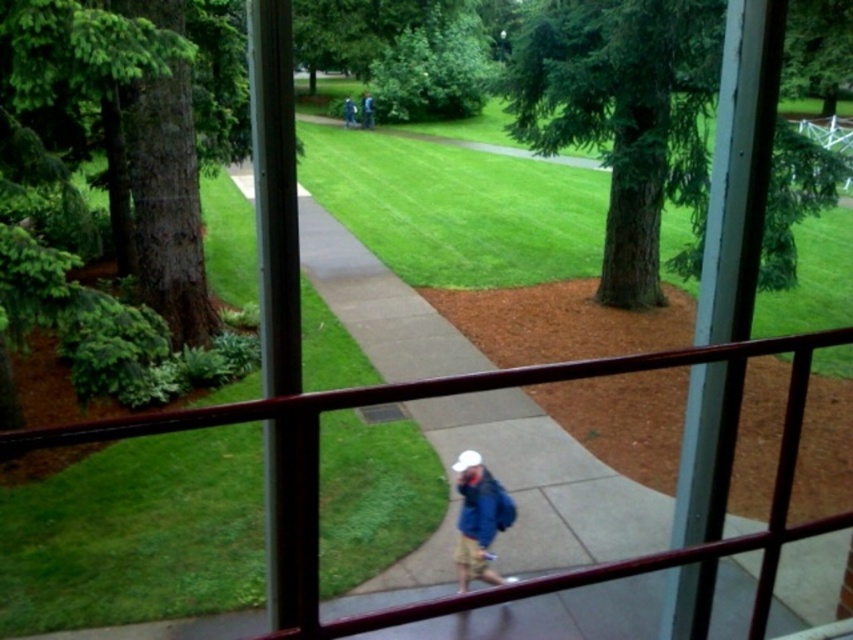
Question: Can you confirm if green leafy tree at upper center is positioned below blue denim jacket at center?

Choices:
 (A) no
 (B) yes

Answer: (A)

Question: Which is nearer to the green leafy tree at upper center?

Choices:
 (A) green textured tree at center
 (B) blue denim jacket at center

Answer: (A)

Question: Which object appears closest to the camera in this image?

Choices:
 (A) blue denim jacket at center
 (B) green textured tree at center

Answer: (A)

Question: Can you confirm if green textured tree at center is positioned to the left of blue denim jacket at center?

Choices:
 (A) yes
 (B) no

Answer: (B)

Question: Based on their relative distances, which object is nearer to the green leafy tree at upper center?

Choices:
 (A) green textured tree at center
 (B) blue denim jacket at center

Answer: (A)

Question: From the image, what is the correct spatial relationship of green textured tree at center in relation to blue denim jacket at center?

Choices:
 (A) right
 (B) left

Answer: (A)